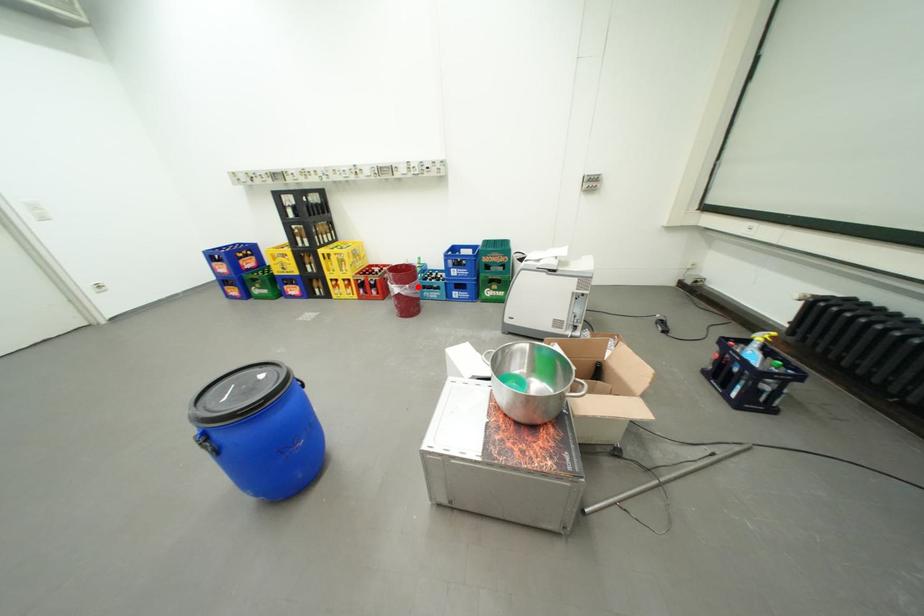
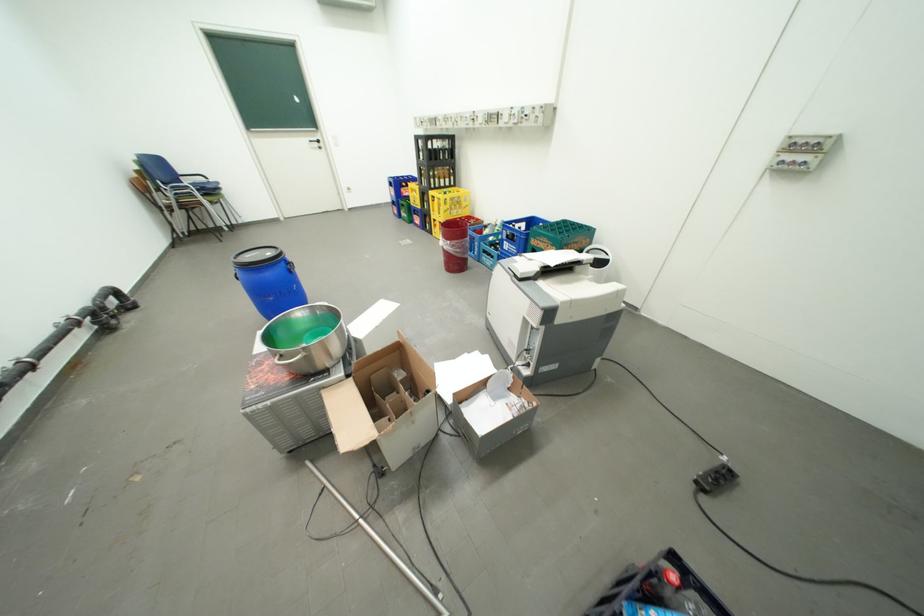
In the second image, find the point that corresponds to the highlighted location in the first image.

(459, 243)